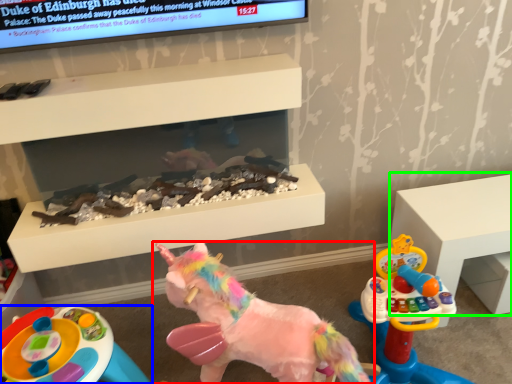
Question: Which is farther away from toy (highlighted by a red box)? toy (highlighted by a blue box) or furniture (highlighted by a green box)?

Choices:
 (A) toy
 (B) furniture

Answer: (B)